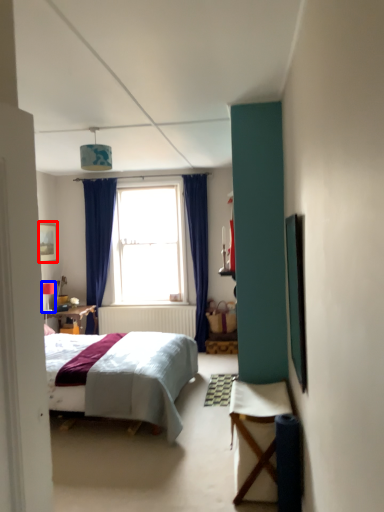
Question: Which object appears closest to the camera in this image, picture frame (highlighted by a red box) or lamp (highlighted by a blue box)?

Choices:
 (A) picture frame
 (B) lamp

Answer: (A)